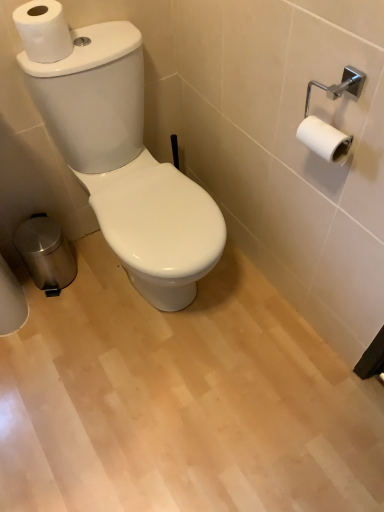
Question: Considering the relative positions of white matte toilet paper at upper left and polished stainless steel trash bin at lower left in the image provided, is white matte toilet paper at upper left to the left of polished stainless steel trash bin at lower left from the viewer's perspective?

Choices:
 (A) yes
 (B) no

Answer: (B)

Question: Is white matte toilet paper at upper left further to the viewer compared to polished stainless steel trash bin at lower left?

Choices:
 (A) no
 (B) yes

Answer: (A)

Question: Can you confirm if white matte toilet paper at upper left is smaller than polished stainless steel trash bin at lower left?

Choices:
 (A) yes
 (B) no

Answer: (A)

Question: From the image's perspective, is white matte toilet paper at upper left located beneath polished stainless steel trash bin at lower left?

Choices:
 (A) no
 (B) yes

Answer: (A)

Question: Are white matte toilet paper at upper left and polished stainless steel trash bin at lower left making contact?

Choices:
 (A) yes
 (B) no

Answer: (B)

Question: Does point (38, 20) appear closer or farther from the camera than point (46, 241)?

Choices:
 (A) farther
 (B) closer

Answer: (B)

Question: In terms of height, does white matte toilet paper at upper left look taller or shorter compared to polished stainless steel trash bin at lower left?

Choices:
 (A) tall
 (B) short

Answer: (B)

Question: Would you say white matte toilet paper at upper left is to the left or to the right of polished stainless steel trash bin at lower left in the picture?

Choices:
 (A) left
 (B) right

Answer: (B)

Question: Is white matte toilet paper at upper left inside the boundaries of polished stainless steel trash bin at lower left, or outside?

Choices:
 (A) outside
 (B) inside

Answer: (A)

Question: In the image, is white glossy toilet at center positioned in front of or behind polished stainless steel trash bin at lower left?

Choices:
 (A) front
 (B) behind

Answer: (A)

Question: Do you think white glossy toilet at center is within polished stainless steel trash bin at lower left, or outside of it?

Choices:
 (A) inside
 (B) outside

Answer: (B)

Question: From the image's perspective, relative to polished stainless steel trash bin at lower left, is white glossy toilet at center above or below?

Choices:
 (A) above
 (B) below

Answer: (A)

Question: Based on their sizes in the image, would you say white glossy toilet at center is bigger or smaller than polished stainless steel trash bin at lower left?

Choices:
 (A) small
 (B) big

Answer: (B)

Question: Is white glossy toilet at center in front of or behind white matte toilet paper at upper left in the image?

Choices:
 (A) front
 (B) behind

Answer: (A)

Question: From a real-world perspective, is white glossy toilet at center above or below white matte toilet paper at upper left?

Choices:
 (A) below
 (B) above

Answer: (A)